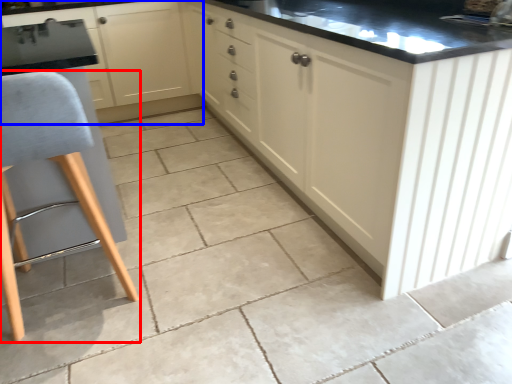
Question: Among these objects, which one is nearest to the camera, furniture (highlighted by a red box) or cabinetry (highlighted by a blue box)?

Choices:
 (A) furniture
 (B) cabinetry

Answer: (A)